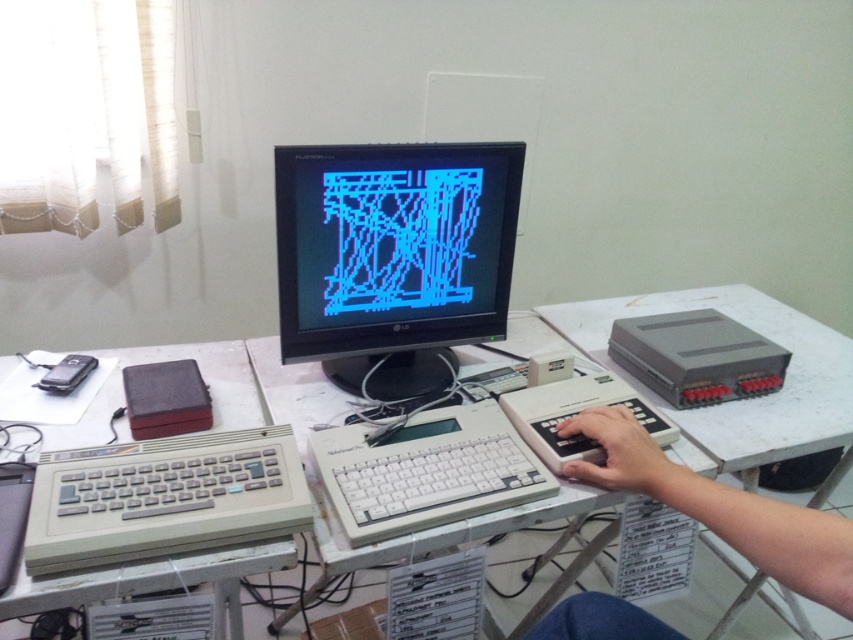
Question: Is white plastic table at center bigger than white plastic hand at center?

Choices:
 (A) yes
 (B) no

Answer: (A)

Question: Does black glossy monitor at center come in front of gray plastic keyboard at center?

Choices:
 (A) yes
 (B) no

Answer: (B)

Question: Which object is closer to the camera taking this photo?

Choices:
 (A) black glossy monitor at center
 (B) white plastic table at center

Answer: (B)

Question: Can you confirm if white plastic table at center is smaller than gray plastic keyboard at center?

Choices:
 (A) no
 (B) yes

Answer: (A)

Question: Which point is closer to the camera?

Choices:
 (A) (656, 637)
 (B) (146, 440)
 (C) (152, 348)

Answer: (A)

Question: Which point appears closest to the camera in this image?

Choices:
 (A) (705, 292)
 (B) (241, 534)

Answer: (B)